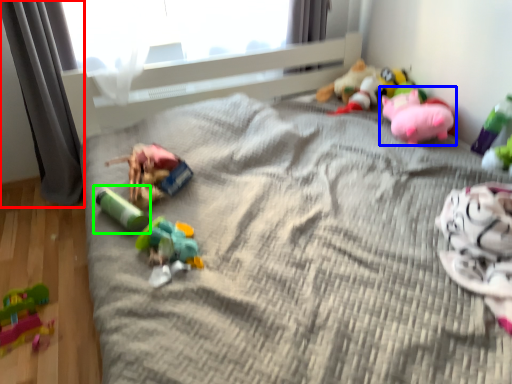
Question: Based on their relative distances, which object is nearer to curtain (highlighted by a red box)? Choose from toy (highlighted by a blue box) and toy (highlighted by a green box).

Choices:
 (A) toy
 (B) toy

Answer: (B)